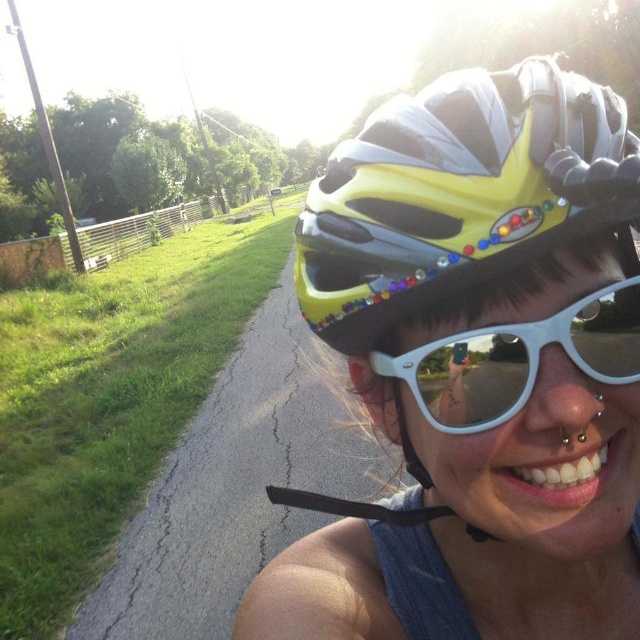
Question: Among these points, which one is nearest to the camera?

Choices:
 (A) (314, 310)
 (B) (440, 348)
 (C) (506, 161)

Answer: (C)

Question: Is yellow shiny helmet at center wider than white reflective sunglasses at center?

Choices:
 (A) yes
 (B) no

Answer: (A)

Question: Among these points, which one is farthest from the camera?

Choices:
 (A) (444, 96)
 (B) (621, 349)

Answer: (A)

Question: Among these objects, which one is nearest to the camera?

Choices:
 (A) yellow shiny helmet at center
 (B) yellow matte helmet at center
 (C) white reflective sunglasses at center

Answer: (B)

Question: Does yellow shiny helmet at center lie in front of white reflective sunglasses at center?

Choices:
 (A) yes
 (B) no

Answer: (A)

Question: Does yellow matte helmet at center appear on the left side of yellow shiny helmet at center?

Choices:
 (A) no
 (B) yes

Answer: (B)